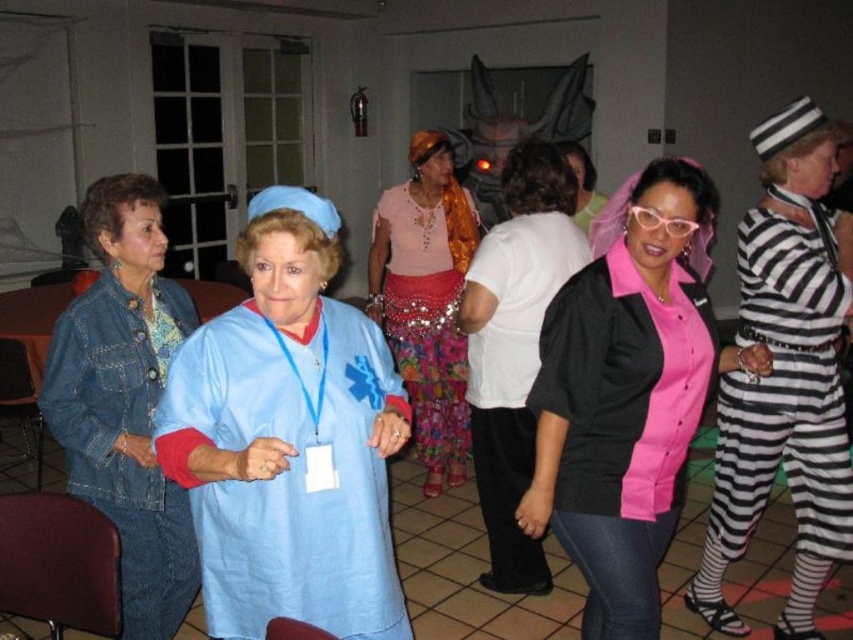
Question: Which point is closer to the camera?

Choices:
 (A) (225, 451)
 (B) (450, 188)
 (C) (669, 236)

Answer: (A)

Question: Is matte blue scrubs at center wider than pink matte shirt at center?

Choices:
 (A) yes
 (B) no

Answer: (B)

Question: Which object is closer to the camera taking this photo?

Choices:
 (A) denim jacket at left
 (B) matte blue scrubs at center
 (C) pink matte shirt at center

Answer: (B)

Question: Which object is farther from the camera taking this photo?

Choices:
 (A) pink matte shirt at center
 (B) pink plastic glasses at center
 (C) matte blue scrubs at center
 (D) shiny sequined skirt at center

Answer: (D)

Question: Can you confirm if denim jacket at left is thinner than pink plastic glasses at center?

Choices:
 (A) no
 (B) yes

Answer: (A)

Question: Considering the relative positions of matte blue scrubs at center and pink plastic glasses at center in the image provided, where is matte blue scrubs at center located with respect to pink plastic glasses at center?

Choices:
 (A) above
 (B) below

Answer: (B)